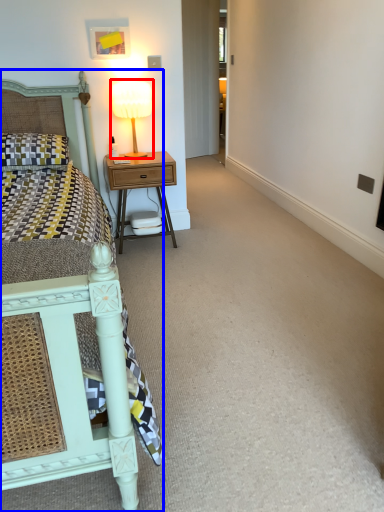
Question: Which object is closer to the camera taking this photo, bedside lamp (highlighted by a red box) or bed (highlighted by a blue box)?

Choices:
 (A) bedside lamp
 (B) bed

Answer: (B)